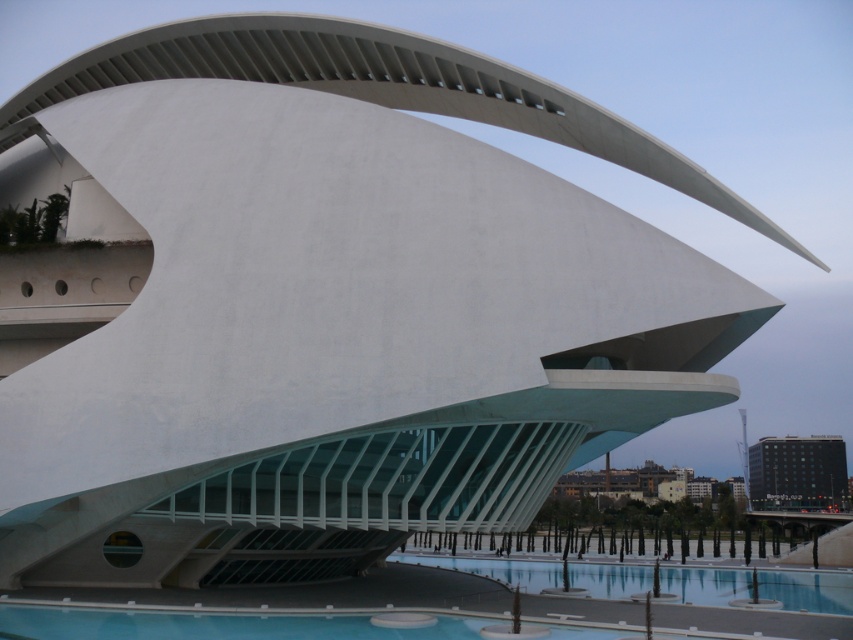
Who is shorter, transparent glass pool at lower center or black glass building at lower right?

With less height is transparent glass pool at lower center.

Is point (850, 600) less distant than point (778, 492)?

Yes.

Where is `transparent glass pool at lower center`? Image resolution: width=853 pixels, height=640 pixels. transparent glass pool at lower center is located at coordinates (805, 589).